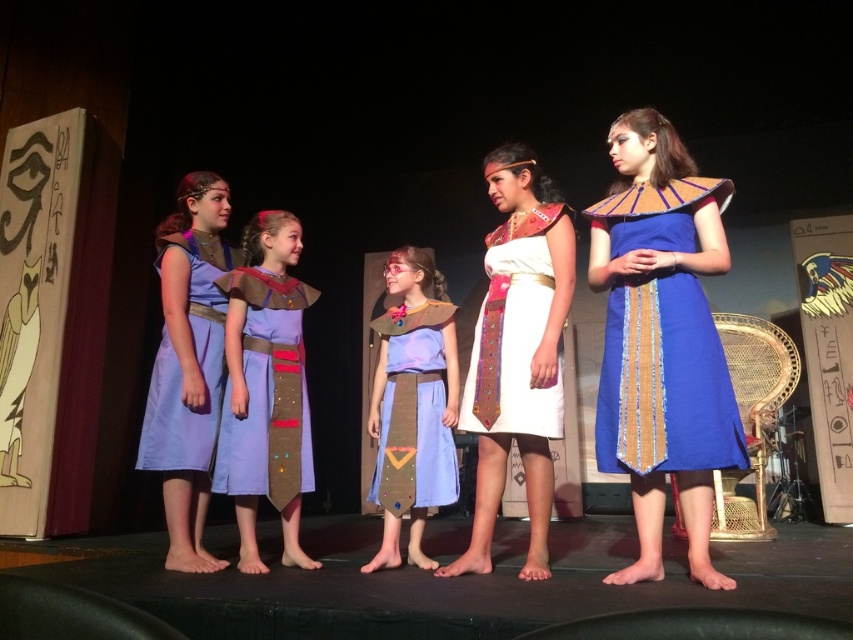
Question: Among these objects, which one is nearest to the camera?

Choices:
 (A) light blue fabric dress at center
 (B) white cotton dress at center
 (C) lavender satin dress at center
 (D) matte blue fabric dress at center

Answer: (B)

Question: Can you confirm if blue woven dress at right is positioned to the right of light blue fabric dress at center?

Choices:
 (A) no
 (B) yes

Answer: (B)

Question: Which object is farther from the camera taking this photo?

Choices:
 (A) lavender satin dress at center
 (B) blue woven dress at right
 (C) matte blue fabric dress at center

Answer: (C)

Question: Is the position of white cotton dress at center more distant than that of light blue fabric dress at center?

Choices:
 (A) no
 (B) yes

Answer: (A)

Question: Where is blue woven dress at right located in relation to light blue fabric dress at center in the image?

Choices:
 (A) right
 (B) left

Answer: (A)

Question: Which of the following is the farthest from the observer?

Choices:
 (A) white satin dress at center
 (B) light blue fabric dress at center
 (C) white cotton dress at center
 (D) matte blue fabric dress at center

Answer: (B)